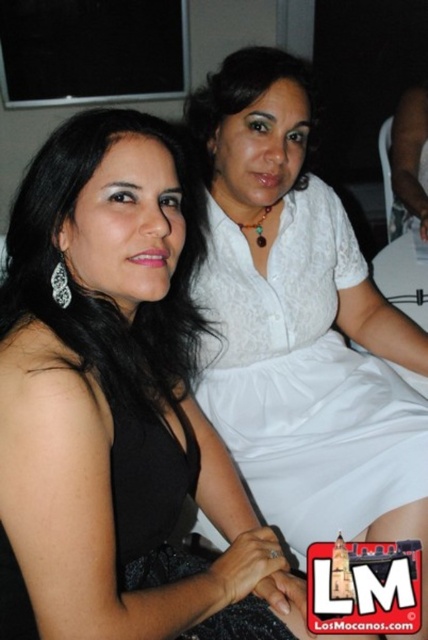
Is black satin dress at left smaller than white lace dress at upper center?

Yes.

Can you confirm if black satin dress at left is wider than white lace dress at upper center?

Yes, black satin dress at left is wider than white lace dress at upper center.

Who is more forward, (273, 564) or (407, 188)?

Point (273, 564)

Locate an element on the screen. The image size is (428, 640). black satin dress at left is located at coordinates (109, 515).

Is white lace dress at upper right smaller than white lace dress at upper center?

Incorrect, white lace dress at upper right is not smaller in size than white lace dress at upper center.

Between point (317, 529) and point (422, 122), which one is positioned behind?

The point (422, 122) is behind.

The image size is (428, 640). I want to click on white lace dress at upper right, so click(x=303, y=378).

Is white lace dress at upper right positioned before black satin dress at left?

No.

Which is in front, point (332, 426) or point (0, 372)?

Point (0, 372) is more forward.

Find the location of a particular element. Image resolution: width=428 pixels, height=640 pixels. white lace dress at upper right is located at coordinates (x=303, y=378).